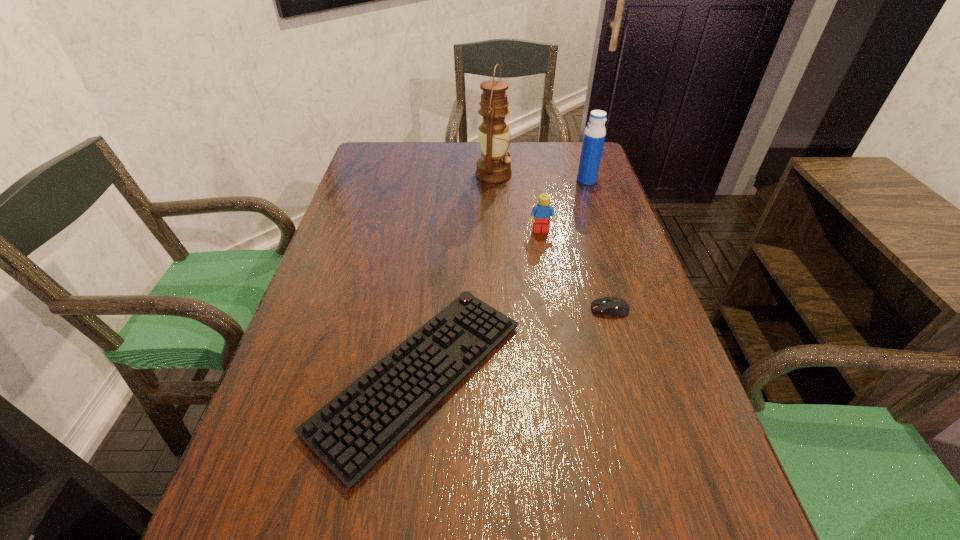
Where is `vacant space located 0.330m on the button of the computer equipment`? The height and width of the screenshot is (540, 960). vacant space located 0.330m on the button of the computer equipment is located at coordinates (438, 309).

Identify the location of free space located on the button of the computer equipment. This screenshot has width=960, height=540. (433, 309).

This screenshot has height=540, width=960. I want to click on free space located on the button of the computer equipment, so click(x=567, y=309).

At what (x,y) coordinates should I click in order to perform the action: click on oil lamp that is at the far edge. Please return your answer as a coordinate pair (x, y). This screenshot has height=540, width=960. Looking at the image, I should click on (495, 166).

Image resolution: width=960 pixels, height=540 pixels. What are the coordinates of `water bottle present at the far edge` in the screenshot? It's located at (594, 136).

Where is `object that is positioned at the left edge`? This screenshot has height=540, width=960. object that is positioned at the left edge is located at coordinates (352, 433).

You are a GUI agent. You are given a task and a screenshot of the screen. Output one action in this format:
    pyautogui.click(x=<x>, y=<y>)
    Task: Click on the water bottle located in the right edge section of the desktop
    
    Given the screenshot: What is the action you would take?
    pyautogui.click(x=594, y=136)

Identify the location of computer equipment that is at the right edge. (614, 306).

Locate an element on the screen. This screenshot has width=960, height=540. object present at the far right corner is located at coordinates (594, 136).

You are a GUI agent. You are given a task and a screenshot of the screen. Output one action in this format:
    pyautogui.click(x=<x>, y=<y>)
    Task: Click on the vacant area at the far edge
    The width and height of the screenshot is (960, 540).
    Given the screenshot: What is the action you would take?
    pyautogui.click(x=521, y=153)